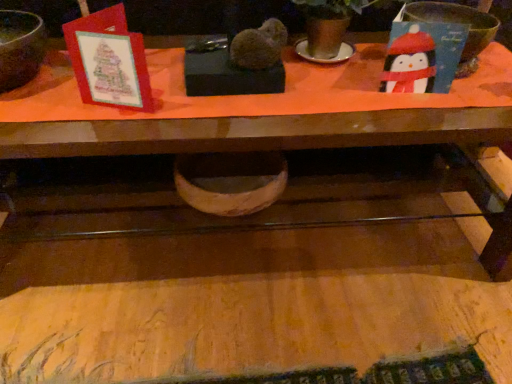
Question: From the image's perspective, is wooden bowl at center, positioned as the first basin in left-to-right order, positioned above or below matte black bowl at right, positioned as the 1th basin in right-to-left order?

Choices:
 (A) below
 (B) above

Answer: (A)

Question: Is wooden bowl at center, positioned as the first basin in left-to-right order, wider or thinner than matte black bowl at right, placed as the second basin when sorted from bottom to top?

Choices:
 (A) wide
 (B) thin

Answer: (A)

Question: Considering the real-world distances, which object is closest to the matte black bowl at right, positioned as the 1th basin in right-to-left order?

Choices:
 (A) wooden table at lower center
 (B) wooden bowl at center, acting as the 1th basin starting from the bottom
 (C) matte brown mixing bowl at upper left

Answer: (B)

Question: Which is farther from the wooden table at lower center?

Choices:
 (A) matte black bowl at right, positioned as the 1th basin in right-to-left order
 (B) matte brown mixing bowl at upper left
 (C) wooden bowl at center, marked as the 2th basin in a top-to-bottom arrangement

Answer: (A)